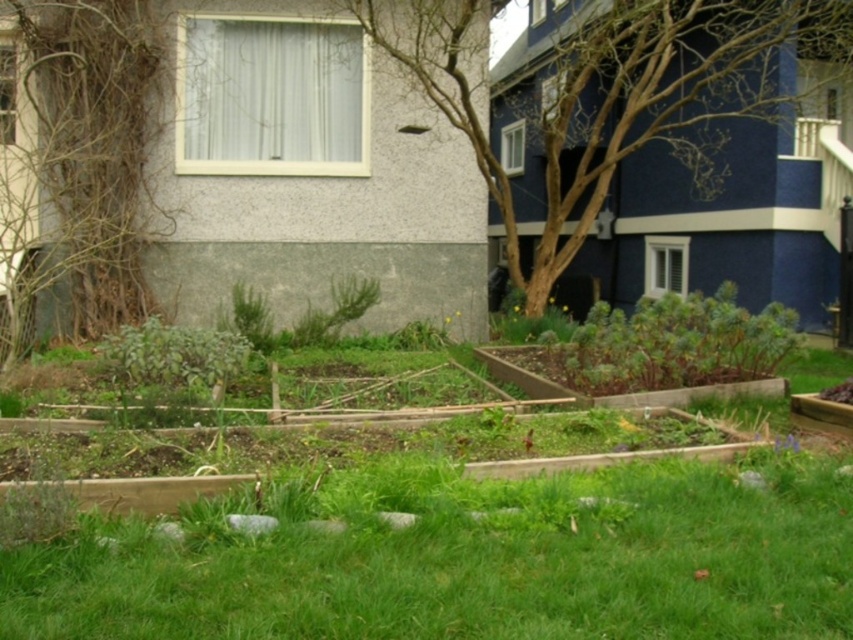
You are a gardener who needs to mow the lawn. You see the green grass at lower center and the brown textured tree at center. Which area should you avoid mowing to prevent damaging the tree?

You should avoid mowing the brown textured tree at center because the green grass at lower center is positioned on its left side, meaning the tree is to the right of the grass. Mowing too close to the tree could damage its roots or trunk.

You are planning to install a new sprinkler system in the backyard. The sprinkler needs to be placed exactly at point 0.147, 0.709 to water the brown textured tree at center. Is there enough space around this point to place the sprinkler without it being too close to any garden beds or grass patches?

The brown textured tree at center is located at point (604, 93). Since the garden beds are in the foreground and the grass patches are interspersed between them, the specified point is likely in the middle ground area where there is more natural vegetation. This suggests there is sufficient space around the point to place the sprinkler without it being too close to the structured garden beds or grass patches.